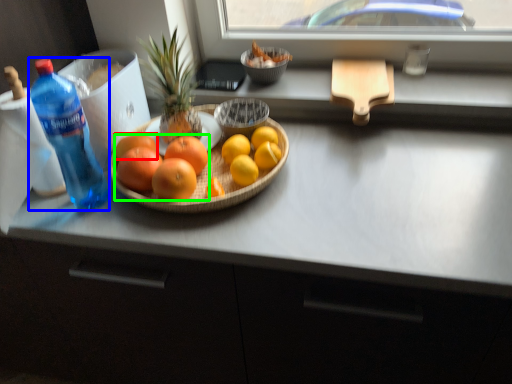
Question: Which is farther away from grapefruit (highlighted by a red box)? bottle (highlighted by a blue box) or grapefruit (highlighted by a green box)?

Choices:
 (A) bottle
 (B) grapefruit

Answer: (A)